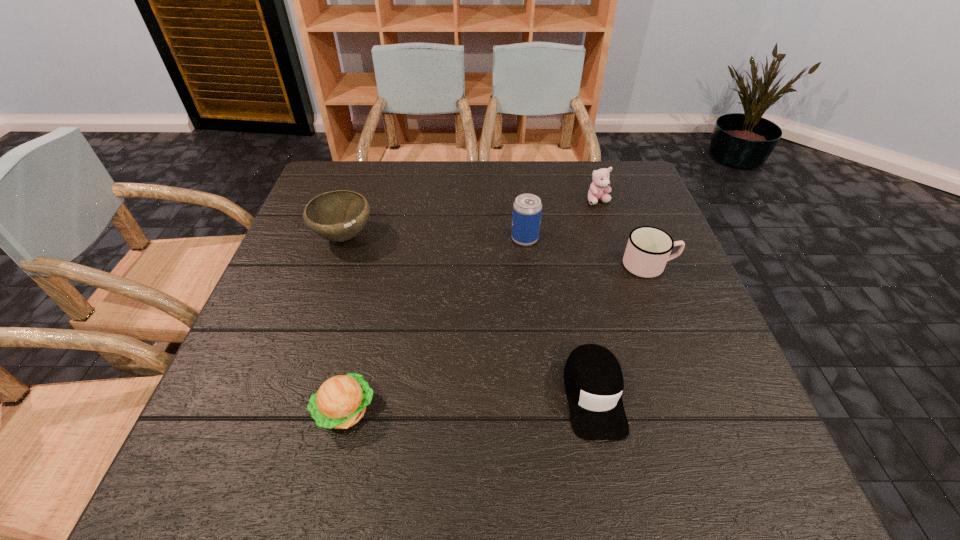
Locate an element on the screen. This screenshot has width=960, height=540. vacant space at the right edge of the desktop is located at coordinates (625, 269).

You are a GUI agent. You are given a task and a screenshot of the screen. Output one action in this format:
    pyautogui.click(x=<x>, y=<y>)
    Task: Click on the vacant point at the far left corner
    This screenshot has height=540, width=960.
    Given the screenshot: What is the action you would take?
    pyautogui.click(x=344, y=174)

In the image, there is a desktop. What are the coordinates of `free space at the far right corner` in the screenshot? It's located at (615, 182).

Locate an element on the screen. The width and height of the screenshot is (960, 540). unoccupied area between the teddy bear and the hamburger is located at coordinates (472, 306).

Find the location of a particular element. This screenshot has width=960, height=540. vacant area that lies between the farthest object and the hamburger is located at coordinates pos(472,306).

You are a GUI agent. You are given a task and a screenshot of the screen. Output one action in this format:
    pyautogui.click(x=<x>, y=<y>)
    Task: Click on the unoccupied area between the beer can and the mug
    
    Given the screenshot: What is the action you would take?
    (x=587, y=252)

Locate an element on the screen. This screenshot has width=960, height=540. free space between the farthest object and the cap is located at coordinates (596, 298).

At what (x,y) coordinates should I click in order to perform the action: click on free spot between the third object from left to right and the mug. Please return your answer as a coordinate pair (x, y). The height and width of the screenshot is (540, 960). Looking at the image, I should click on (587, 252).

Where is `vacant space that's between the farthest object and the bowl`? vacant space that's between the farthest object and the bowl is located at coordinates (471, 219).

Locate an element on the screen. unoccupied position between the cap and the hamburger is located at coordinates (469, 403).